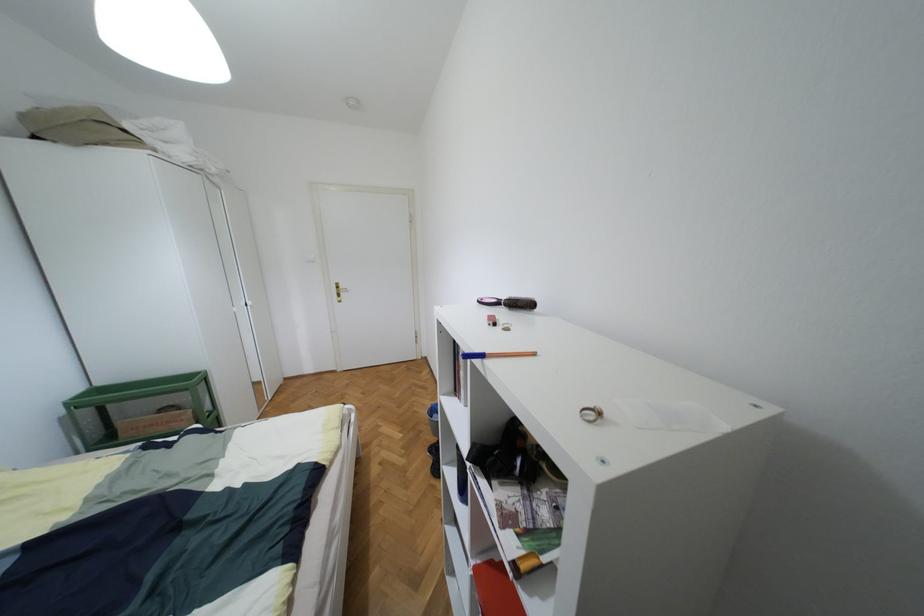
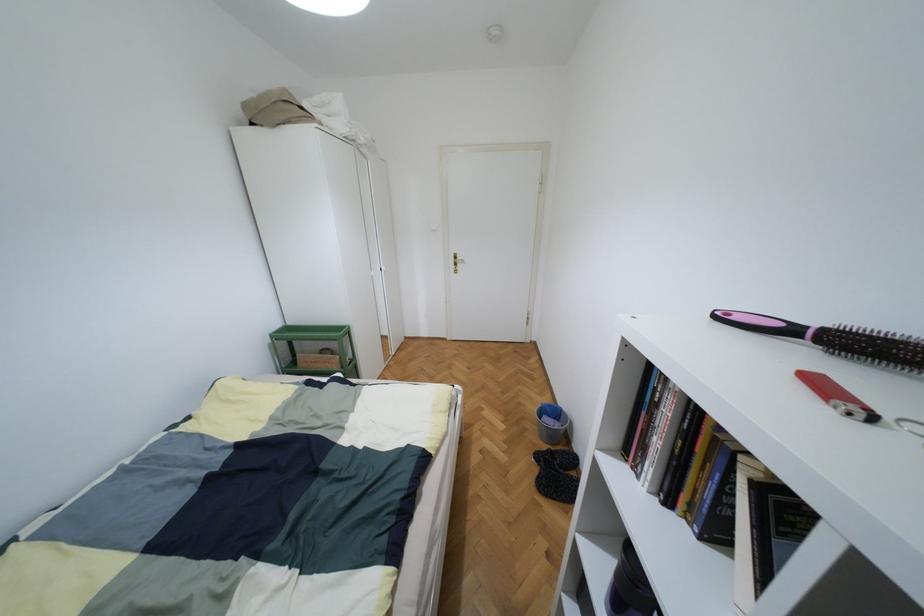
Question: Based on the continuous images, in which direction is the camera rotating? Reply with the corresponding letter.

Choices:
 (A) Left
 (B) Right
 (C) Up
 (D) Down

Answer: (A)